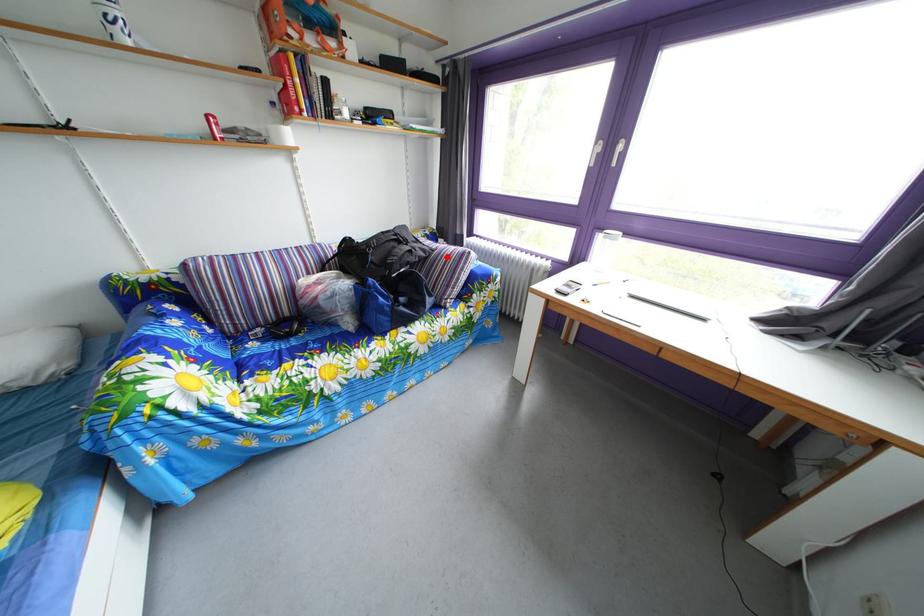
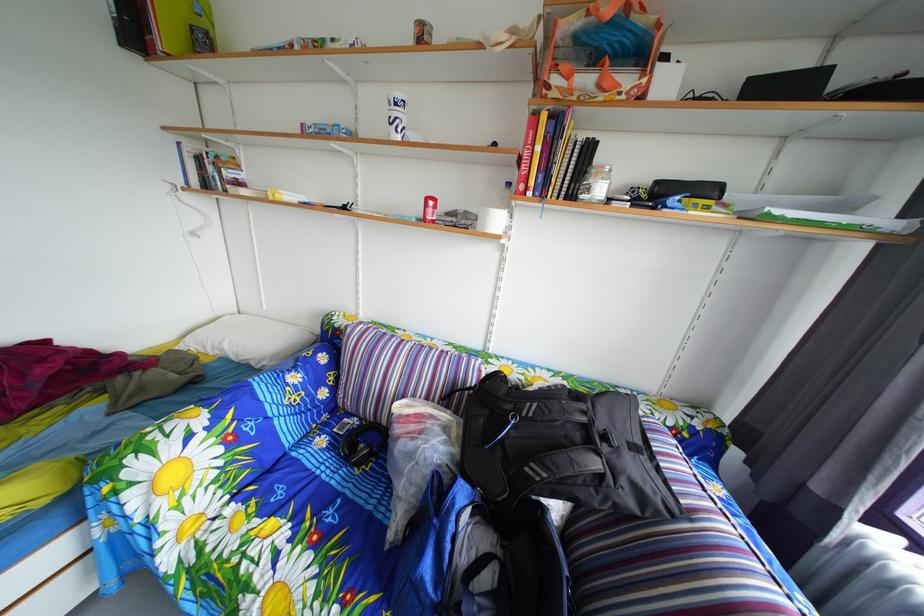
Question: I am providing you with two images of the same scene from different viewpoints. Image1 has a red point marked. In image2, the corresponding 3D location appears at what relative position? Reply with the corresponding letter.

Choices:
 (A) Closer
 (B) Farther

Answer: (B)